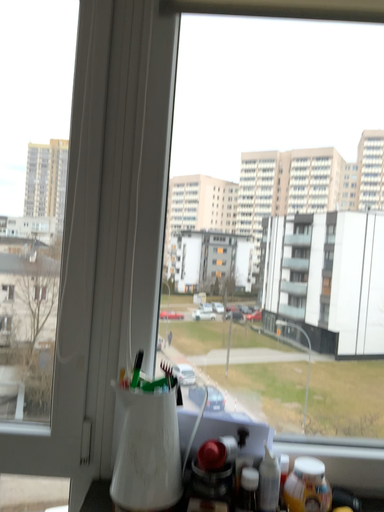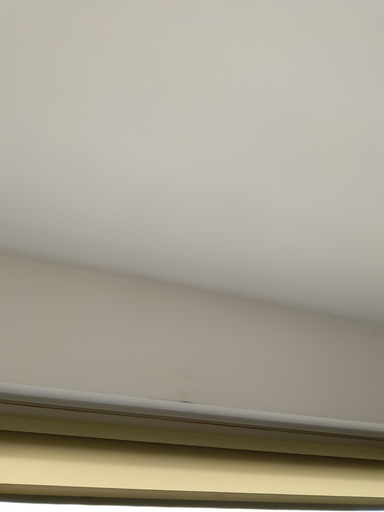
Question: How did the camera likely rotate when shooting the video?

Choices:
 (A) rotated left
 (B) rotated right

Answer: (B)